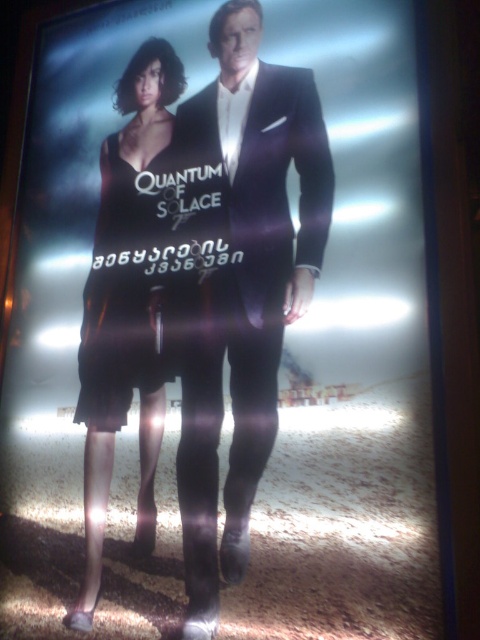
Image resolution: width=480 pixels, height=640 pixels. Describe the element at coordinates (248, 275) in the screenshot. I see `shiny black suit at center` at that location.

Is point (332, 173) closer to camera compared to point (144, 364)?

Yes.

Is point (192, 163) more distant than point (136, 250)?

No, it is in front of (136, 250).

At what (x,y) coordinates should I click in order to perform the action: click on shiny black suit at center. Please return your answer as a coordinate pair (x, y). Looking at the image, I should click on (248, 275).

Does shiny black suit at center have a lesser width compared to satin black dress at left?

No, shiny black suit at center is not thinner than satin black dress at left.

Consider the image. Who is more forward, (237, 125) or (99, 476)?

Point (99, 476) is in front.

Between point (252, 314) and point (107, 349), which one is positioned behind?

The point (107, 349) is more distant.

This screenshot has height=640, width=480. In order to click on shiny black suit at center in this screenshot , I will do `click(248, 275)`.

Is point (108, 429) positioned behind point (100, 196)?

No, it is not.

Does satin black dress at left have a smaller size compared to black satin dress at center?

No.

Between point (94, 444) and point (126, 188), which one is positioned in front?

Point (94, 444) is more forward.

Find the location of a particular element. Image resolution: width=480 pixels, height=640 pixels. satin black dress at left is located at coordinates (123, 310).